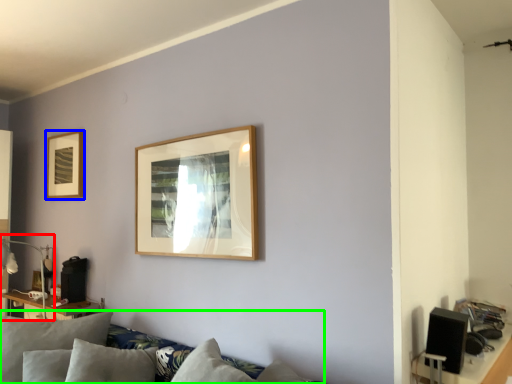
Question: Which is farther away from lamp (highlighted by a red box)? picture frame (highlighted by a blue box) or couch (highlighted by a green box)?

Choices:
 (A) picture frame
 (B) couch

Answer: (B)